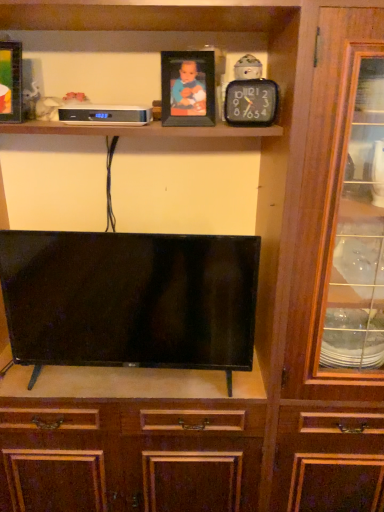
Question: Does point (248, 88) appear closer or farther from the camera than point (120, 112)?

Choices:
 (A) closer
 (B) farther

Answer: (A)

Question: In terms of height, does black plastic clock at upper center look taller or shorter compared to white plastic clock at upper center?

Choices:
 (A) short
 (B) tall

Answer: (B)

Question: Estimate the real-world distances between objects in this image. Which object is closer to the wooden photo frame at upper center, which is counted as the first picture frame, starting from the right?

Choices:
 (A) matte black picture frame at upper left, positioned as the 2th picture frame in right-to-left order
 (B) white plastic clock at upper center
 (C) black plastic clock at upper center
 (D) black glossy tv at center

Answer: (C)

Question: Based on their relative distances, which object is farther from the black plastic clock at upper center?

Choices:
 (A) wooden photo frame at upper center, the second picture frame from the left
 (B) white plastic clock at upper center
 (C) black glossy tv at center
 (D) matte black picture frame at upper left, positioned as the 2th picture frame in right-to-left order

Answer: (D)